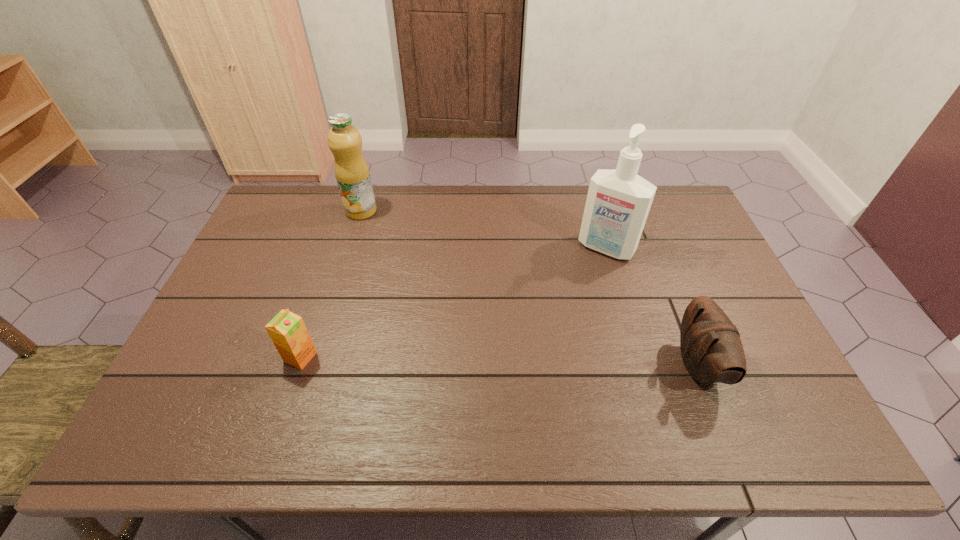
This screenshot has width=960, height=540. In the image, there is a desktop. Find the location of `free space at the left edge`. free space at the left edge is located at coordinates (232, 303).

This screenshot has height=540, width=960. I want to click on free point at the right edge, so click(x=694, y=263).

This screenshot has height=540, width=960. I want to click on vacant space at the far left corner, so click(270, 209).

This screenshot has height=540, width=960. In order to click on vacant area at the far right corner of the desktop in this screenshot , I will do `click(679, 193)`.

Image resolution: width=960 pixels, height=540 pixels. Identify the location of unoccupied area between the second farthest object and the rightmost object. (653, 306).

At what (x,y) coordinates should I click in order to perform the action: click on blank region between the tallest object and the orange juice. Please return your answer as a coordinate pair (x, y). Looking at the image, I should click on (453, 302).

You are a GUI agent. You are given a task and a screenshot of the screen. Output one action in this format:
    pyautogui.click(x=<x>, y=<y>)
    Task: Click on the empty location between the farthest object and the rightmost object
    This screenshot has height=540, width=960.
    Given the screenshot: What is the action you would take?
    pyautogui.click(x=530, y=288)

The image size is (960, 540). What are the coordinates of `vacant region between the pouch and the second object from right to left` in the screenshot? It's located at (653, 306).

At what (x,y) coordinates should I click in order to perform the action: click on free space between the orange juice and the second tallest object. Please return your answer as a coordinate pair (x, y). This screenshot has height=540, width=960. Looking at the image, I should click on [331, 284].

Where is `empty space that is in between the orange juice and the pouch`? The height and width of the screenshot is (540, 960). empty space that is in between the orange juice and the pouch is located at coordinates (499, 361).